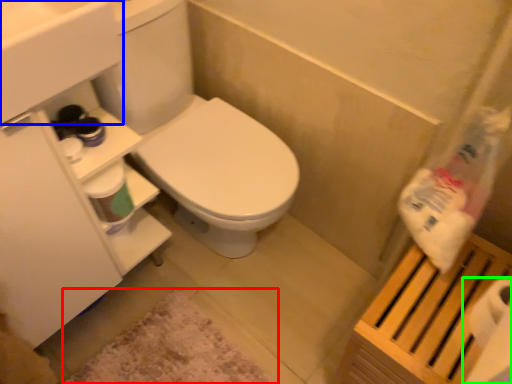
Question: Considering the real-world distances, which object is closest to bath mat (highlighted by a red box)? sink (highlighted by a blue box) or toilet paper (highlighted by a green box).

Choices:
 (A) sink
 (B) toilet paper

Answer: (B)